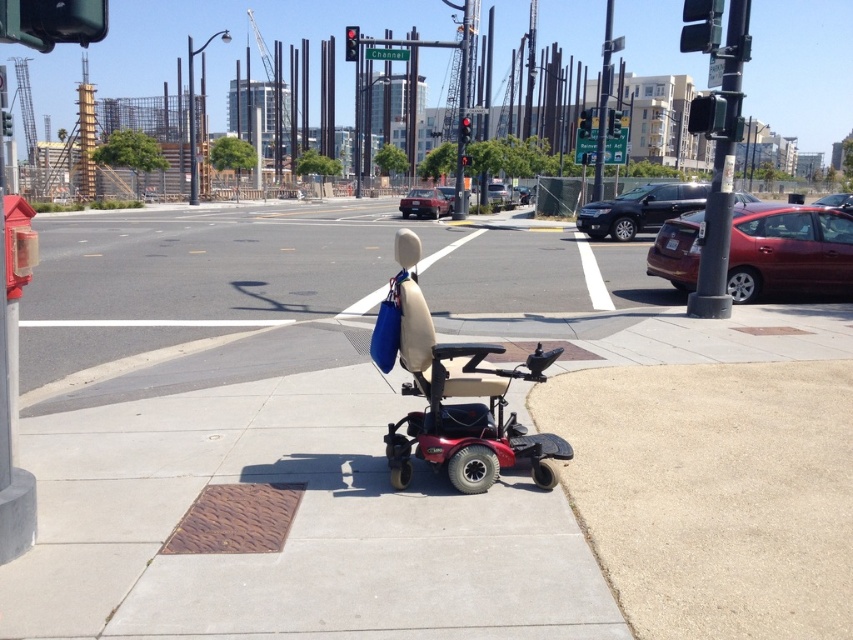
You are navigating a motorized wheelchair with a turning radius of 0.5 meters. You need to move from the current position to the point marked by point (706, 35) and then to point (619, 122). Can you safely make this path without hitting anything?

Point (706, 35) is in front of point (619, 122). Since the wheelchair has a turning radius of 0.5 meters, it can navigate the path as long as there is enough space between the points to maneuver without obstacles. The description does not mention any obstacles between them, so the path should be safe.

You are navigating a motorized wheelchair from the sidewalk towards the crosswalk. There are two points marked on the path. The first point is at coordinates point (624, 224) and the second point is at coordinates point (584, 120). Which point should you reach first while moving forward?

You should reach point (624, 224) first because it is in front of point (584, 120) along your path.

You are a delivery person who needs to park your shiny black sedan at center in a spot that is as wide as the metallic traffic light at upper center. Can your car fit in that spot?

The shiny black sedan at center has a width less than the metallic traffic light at upper center, so yes, the car can fit in the parking spot as wide as the traffic light.